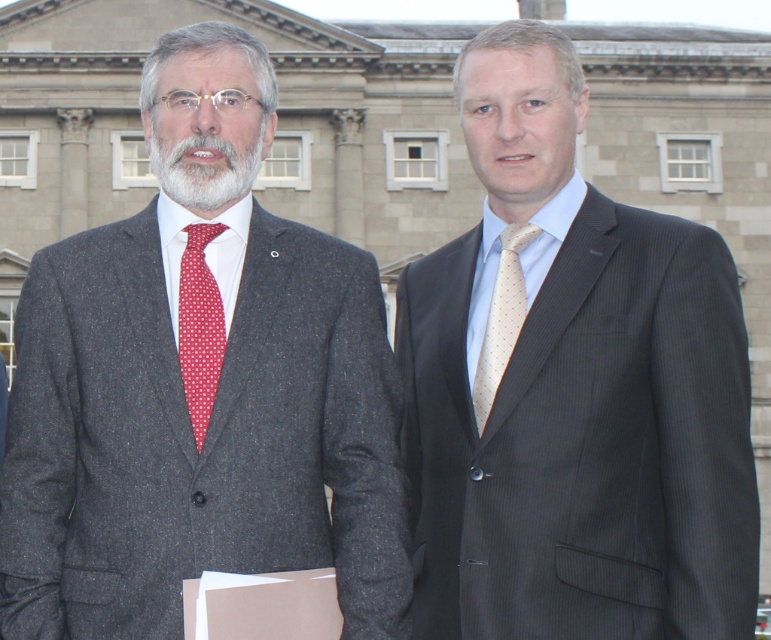
Can you confirm if matte black suit at right is smaller than red dotted fabric tie at left?

No.

Does matte black suit at right appear on the right side of red dotted fabric tie at left?

Correct, you'll find matte black suit at right to the right of red dotted fabric tie at left.

Identify the location of matte black suit at right. (571, 388).

Find the location of `matte gray suit at left`. matte gray suit at left is located at coordinates (192, 432).

Does matte gray suit at left appear on the right side of pale yellow dotted tie at center?

In fact, matte gray suit at left is to the left of pale yellow dotted tie at center.

Is point (19, 340) closer to camera compared to point (487, 406)?

Yes, point (19, 340) is closer to viewer.

Identify the location of matte gray suit at left. Image resolution: width=771 pixels, height=640 pixels. (192, 432).

Is point (211, 333) positioned before point (153, 129)?

Yes, it is in front of point (153, 129).

Can you confirm if red dotted fabric tie at left is thinner than gray/woolly beard at center?

Indeed, red dotted fabric tie at left has a lesser width compared to gray/woolly beard at center.

Does point (201, 234) come behind point (204, 168)?

Yes.

The image size is (771, 640). What are the coordinates of `red dotted fabric tie at left` in the screenshot? It's located at (199, 326).